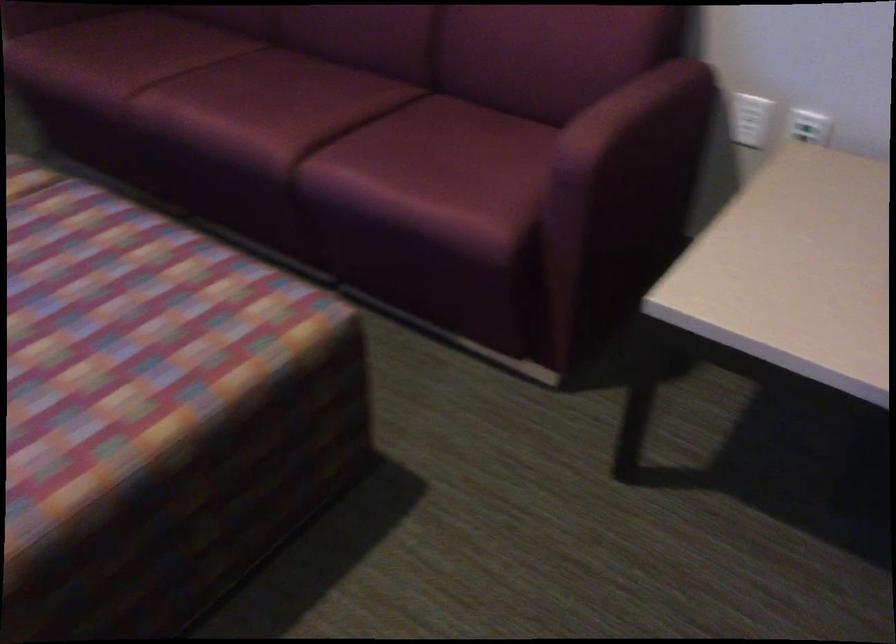
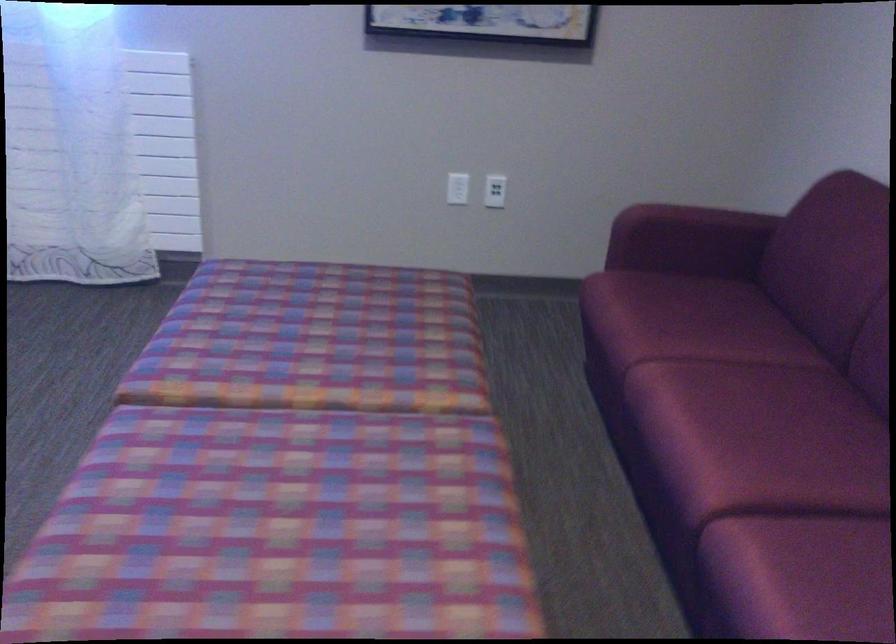
Question: Based on the continuous images, in which direction is the camera rotating? Reply with the corresponding letter.

Choices:
 (A) Left
 (B) Right
 (C) Up
 (D) Down

Answer: (A)